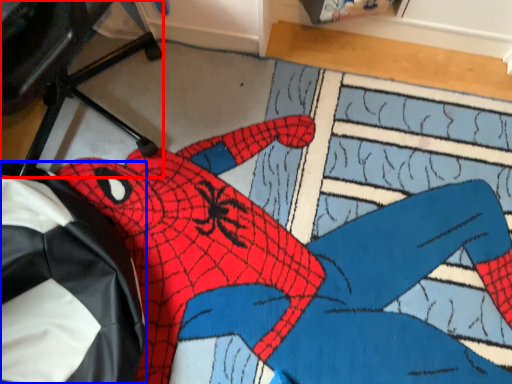
Question: Among these objects, which one is farthest to the camera, computer chair (highlighted by a red box) or bean bag chair (highlighted by a blue box)?

Choices:
 (A) computer chair
 (B) bean bag chair

Answer: (B)